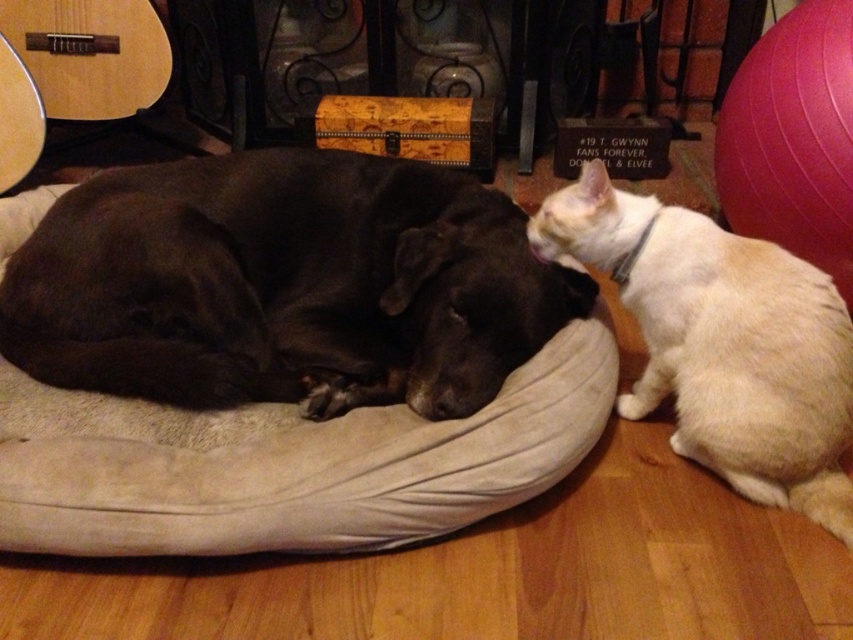
Question: Which point appears closest to the camera in this image?

Choices:
 (A) (809, 372)
 (B) (408, 241)

Answer: (A)

Question: Is shiny black dog at center to the left of white fur cat at right from the viewer's perspective?

Choices:
 (A) yes
 (B) no

Answer: (A)

Question: Is the position of shiny black dog at center more distant than that of white fur cat at right?

Choices:
 (A) no
 (B) yes

Answer: (A)

Question: Among these points, which one is nearest to the camera?

Choices:
 (A) (469, 344)
 (B) (752, 246)

Answer: (A)

Question: From the image, what is the correct spatial relationship of shiny black dog at center in relation to white fur cat at right?

Choices:
 (A) below
 (B) above

Answer: (B)